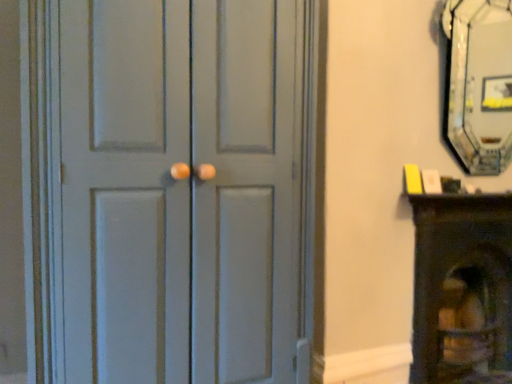
At what (x,y) coordinates should I click in order to perform the action: click on free point below black glass fireplace at upper right (from a real-world perspective). Please return your answer as a coordinate pair (x, y). This screenshot has width=512, height=384. Looking at the image, I should click on click(x=485, y=186).